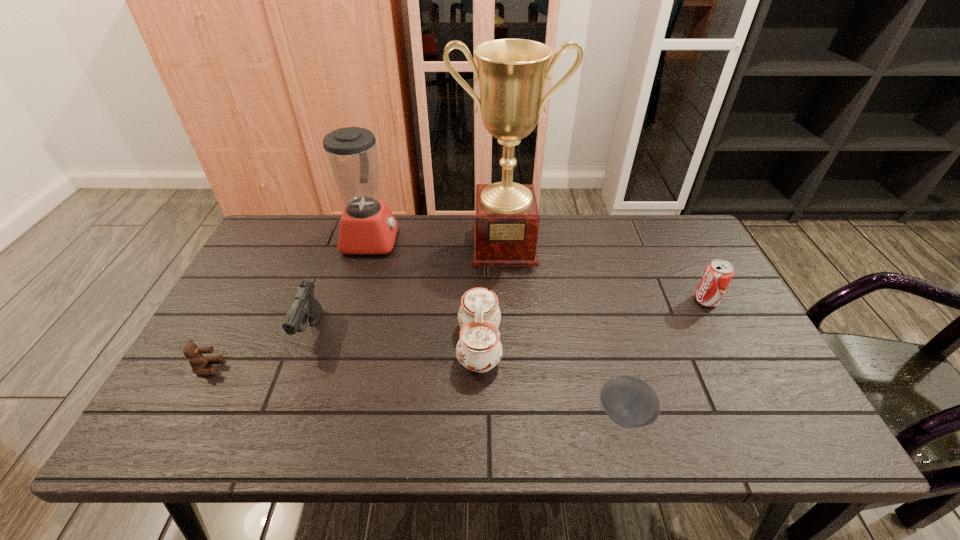
Locate an element on the screen. This screenshot has width=960, height=540. object located in the right edge section of the desktop is located at coordinates (718, 273).

Image resolution: width=960 pixels, height=540 pixels. Identify the location of vacant space at the far edge of the desktop. (590, 241).

The image size is (960, 540). In order to click on free space at the near edge of the desktop in this screenshot , I will do `click(486, 418)`.

Locate an element on the screen. free space at the left edge is located at coordinates (227, 343).

This screenshot has height=540, width=960. What are the coordinates of `vacant space at the right edge` in the screenshot? It's located at (713, 332).

You are a GUI agent. You are given a task and a screenshot of the screen. Output one action in this format:
    pyautogui.click(x=<x>, y=<y>)
    Task: Click on the free space between the teddy bear and the bowl
    This screenshot has height=540, width=960.
    Given the screenshot: What is the action you would take?
    pyautogui.click(x=417, y=390)

In order to click on free space between the bowl and the pistol in this screenshot , I will do `click(468, 372)`.

Locate an element on the screen. empty space between the rightmost object and the leftmost object is located at coordinates (457, 334).

The width and height of the screenshot is (960, 540). Find the location of `free point between the sixth object from left to right and the trophy cup`. free point between the sixth object from left to right and the trophy cup is located at coordinates (564, 329).

This screenshot has width=960, height=540. Find the location of `vacant space that is in between the shortest object and the pistol`. vacant space that is in between the shortest object and the pistol is located at coordinates (468, 372).